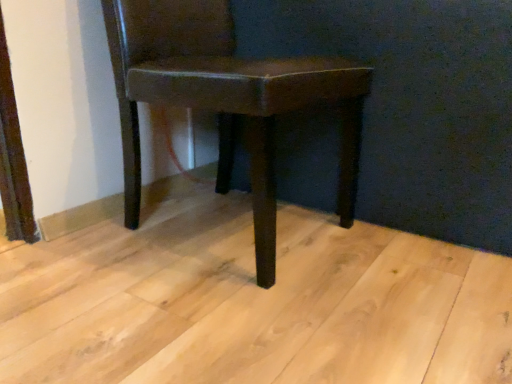
Where is `vacant region in front of matte brown leather chair at center`? The image size is (512, 384). vacant region in front of matte brown leather chair at center is located at coordinates (218, 315).